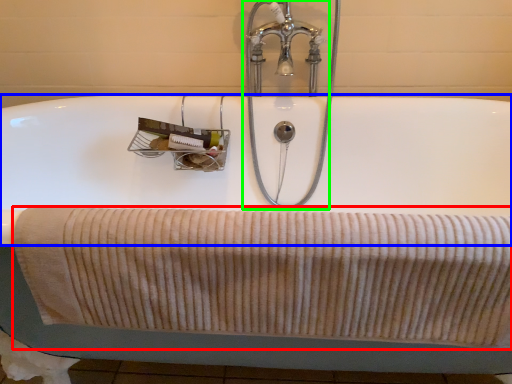
Question: Which object is the closest to the bath towel (highlighted by a red box)? Choose among these: bath (highlighted by a blue box) or tap (highlighted by a green box).

Choices:
 (A) bath
 (B) tap

Answer: (A)